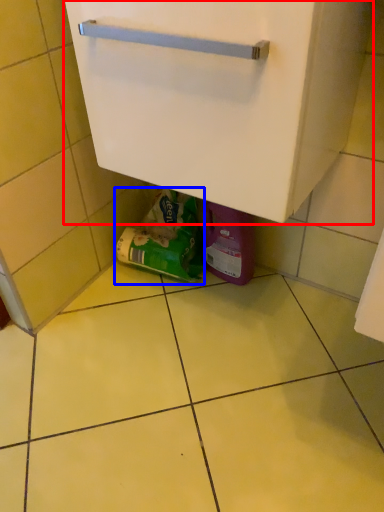
Question: Which point is closer to the camera, cabinetry (highlighted by a red box) or garbage (highlighted by a blue box)?

Choices:
 (A) cabinetry
 (B) garbage

Answer: (A)